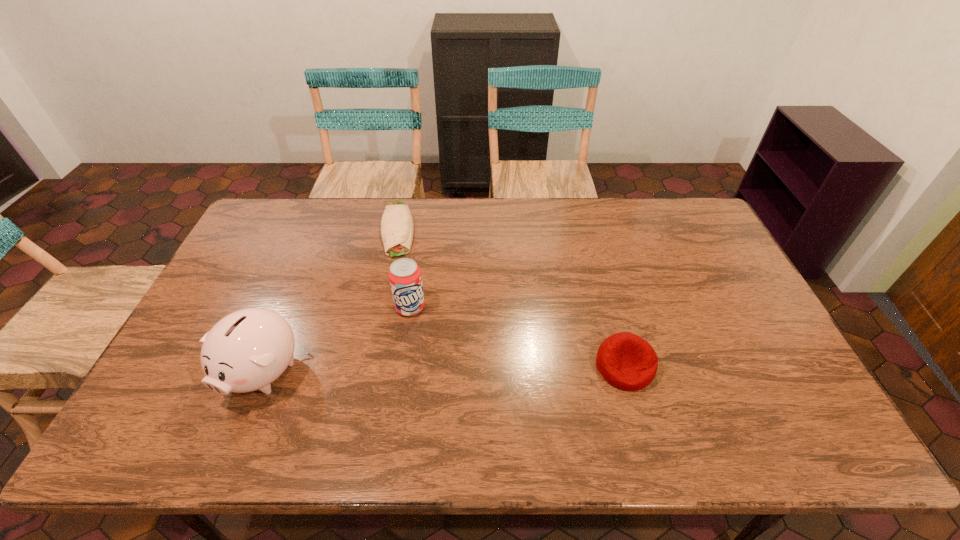
Identify the location of free area in between the burrito and the piggy bank. (330, 300).

Where is `free space between the rightmost object and the third nearest object`? free space between the rightmost object and the third nearest object is located at coordinates (517, 337).

Locate an element on the screen. free space between the farthest object and the beanbag is located at coordinates (511, 298).

Where is `object that stands as the third closest to the third shortest object`? The width and height of the screenshot is (960, 540). object that stands as the third closest to the third shortest object is located at coordinates (625, 360).

Identify which object is the third closest to the third nearest object. Please provide its 2D coordinates. Your answer should be formatted as a tuple, i.e. [(x, y)], where the tuple contains the x and y coordinates of a point satisfying the conditions above.

[(625, 360)]